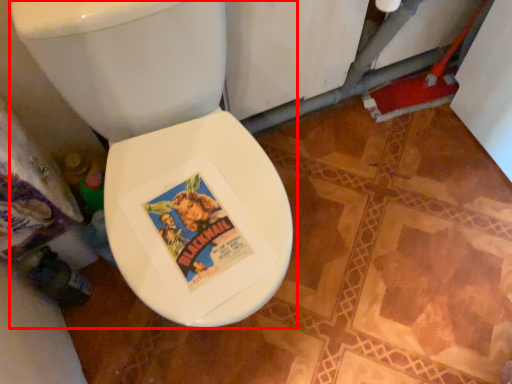
Question: In this image, where is toilet (annotated by the red box) located relative to bidet?

Choices:
 (A) left
 (B) right

Answer: (A)